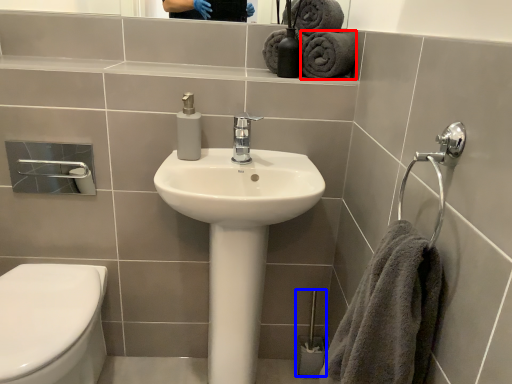
Question: Among these objects, which one is farthest to the camera, bath towel (highlighted by a red box) or brush (highlighted by a blue box)?

Choices:
 (A) bath towel
 (B) brush

Answer: (B)